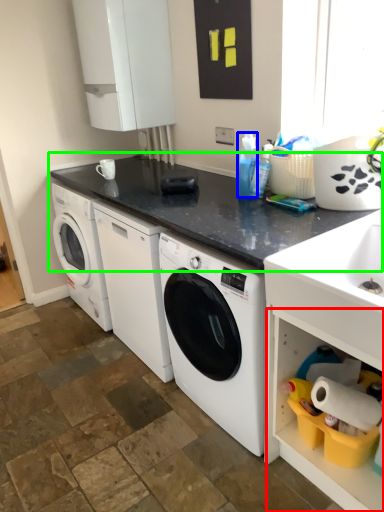
Question: Which object is positioned closest to shelf (highlighted by a red box)? Select from cleaning product (highlighted by a blue box) and countertop (highlighted by a green box).

Choices:
 (A) cleaning product
 (B) countertop

Answer: (B)